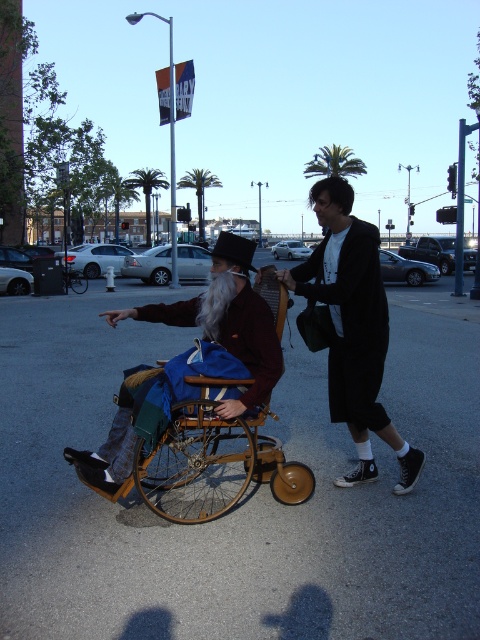
You are a delivery person trying to place a small package between the black leather jacket at center and the wooden wheelchair at center. Can you fit the package there?

The black leather jacket at center is thinner than the wooden wheelchair at center, so there is space between them. The package can be placed there.

You are a delivery person who needs to place a package on the wooden wheelchair at center. However, there is a black leather jacket at center in the way. Can you move the jacket to access the wheelchair?

The wooden wheelchair at center is behind the black leather jacket at center, so you can move the black leather jacket at center to access the wooden wheelchair at center.

You are a delivery person who needs to place a small package on the black leather jacket at center. Based on the coordinates provided, where exactly should you place the package?

The black leather jacket at center is located at coordinates point (352, 328), so you should place the package there.